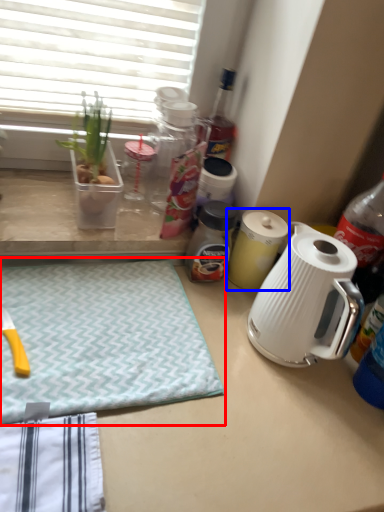
Question: Which point is further to the camera, yoga mat (highlighted by a red box) or kitchen appliance (highlighted by a blue box)?

Choices:
 (A) yoga mat
 (B) kitchen appliance

Answer: (B)